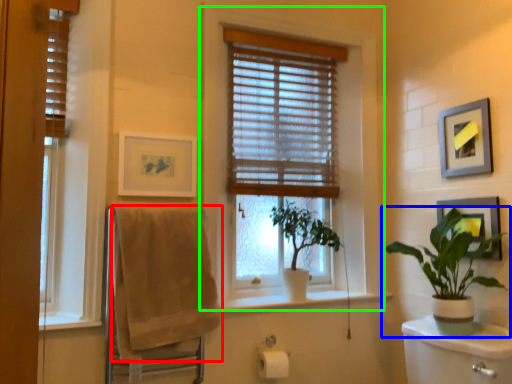
Question: Based on their relative distances, which object is nearer to bath towel (highlighted by a red box)? Choose from houseplant (highlighted by a blue box) and window (highlighted by a green box).

Choices:
 (A) houseplant
 (B) window

Answer: (B)